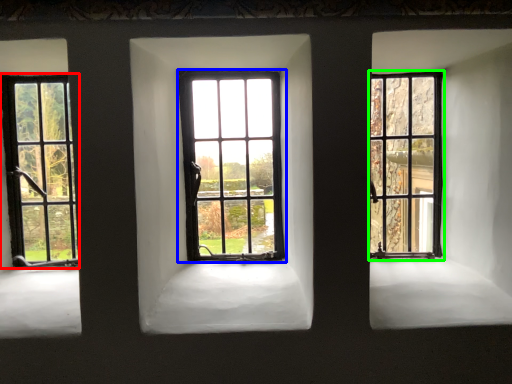
Question: Considering the real-world distances, which object is farthest from window (highlighted by a red box)? window (highlighted by a blue box) or window (highlighted by a green box)?

Choices:
 (A) window
 (B) window

Answer: (B)